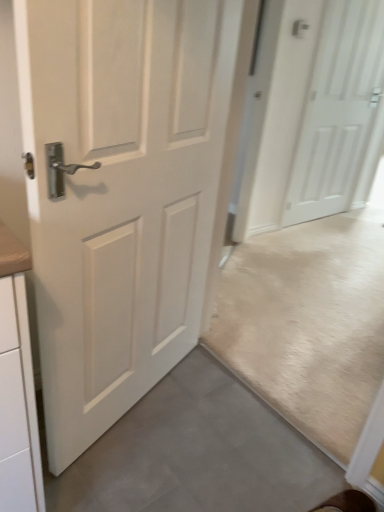
What do you see at coordinates (338, 110) in the screenshot? This screenshot has width=384, height=512. I see `white matte door at upper right, which ranks as the second door in front-to-back order` at bounding box center [338, 110].

This screenshot has height=512, width=384. I want to click on white matte door at upper right, the 2th door positioned from the left, so click(338, 110).

What is the approximate width of white matte door at upper right, which appears as the 1th door when viewed from the back?

white matte door at upper right, which appears as the 1th door when viewed from the back, is 2.31 inches in width.

What do you see at coordinates (121, 194) in the screenshot?
I see `white matte door at center, which appears as the 2th door when viewed from the back` at bounding box center [121, 194].

I want to click on white matte door at center, the 2th door viewed from the right, so click(121, 194).

Identify the location of white matte door at upper right, the first door from the right. (338, 110).

Which is more to the right, white matte door at center, the first door when ordered from front to back, or white matte door at upper right, which ranks as the second door in front-to-back order?

From the viewer's perspective, white matte door at upper right, which ranks as the second door in front-to-back order, appears more on the right side.

Considering the positions of objects white matte door at center, which appears as the 2th door when viewed from the back, and white matte door at upper right, the first door from the right, in the image provided, who is behind, white matte door at center, which appears as the 2th door when viewed from the back, or white matte door at upper right, the first door from the right,?

white matte door at upper right, the first door from the right.

Does point (110, 42) appear closer or farther from the camera than point (347, 49)?

Point (110, 42) is positioned closer to the camera compared to point (347, 49).

From the image's perspective, would you say white matte door at center, which is the 1th door from left to right, is shown under white matte door at upper right, which appears as the 1th door when viewed from the back?

Correct, white matte door at center, which is the 1th door from left to right, appears lower than white matte door at upper right, which appears as the 1th door when viewed from the back, in the image.

From a real-world perspective, is white matte door at center, which appears as the 2th door when viewed from the back, over white matte door at upper right, the first door from the right?

No, from a real-world perspective, white matte door at center, which appears as the 2th door when viewed from the back, is not over white matte door at upper right, the first door from the right

Between white matte door at center, which appears as the 2th door when viewed from the back, and white matte door at upper right, which ranks as the second door in front-to-back order, which one has smaller width?

white matte door at upper right, which ranks as the second door in front-to-back order, is thinner.

Considering the sizes of white matte door at center, the first door when ordered from front to back, and white matte door at upper right, which ranks as the second door in front-to-back order, in the image, is white matte door at center, the first door when ordered from front to back, taller or shorter than white matte door at upper right, which ranks as the second door in front-to-back order,?

Considering their sizes, white matte door at center, the first door when ordered from front to back, has less height than white matte door at upper right, which ranks as the second door in front-to-back order.

Based on the photo, who is bigger, white matte door at center, the 2th door viewed from the right, or white matte door at upper right, which ranks as the second door in front-to-back order?

Bigger between the two is white matte door at center, the 2th door viewed from the right.

Consider the image. Would you say white matte door at center, which appears as the 2th door when viewed from the back, is outside white matte door at upper right, which ranks as the second door in front-to-back order?

That's correct, white matte door at center, which appears as the 2th door when viewed from the back, is outside of white matte door at upper right, which ranks as the second door in front-to-back order.

Is white matte door at center, the 2th door viewed from the right, not near white matte door at upper right, the first door from the right?

white matte door at center, the 2th door viewed from the right, is positioned a significant distance from white matte door at upper right, the first door from the right.

Is white matte door at center, which appears as the 2th door when viewed from the back, turned away from white matte door at upper right, the first door from the right?

white matte door at center, which appears as the 2th door when viewed from the back, is not turned away from white matte door at upper right, the first door from the right.

This screenshot has height=512, width=384. In order to click on door above the white matte door at center, the first door when ordered from front to back (from a real-world perspective) in this screenshot , I will do `click(338, 110)`.

Which is more to the left, white matte door at upper right, the 2th door positioned from the left, or white matte door at center, which appears as the 2th door when viewed from the back?

From the viewer's perspective, white matte door at center, which appears as the 2th door when viewed from the back, appears more on the left side.

Is white matte door at upper right, which appears as the 1th door when viewed from the back, in front of or behind white matte door at center, the first door when ordered from front to back, in the image?

Visually, white matte door at upper right, which appears as the 1th door when viewed from the back, is located behind white matte door at center, the first door when ordered from front to back.

Based on the photo, which is nearer, (x=376, y=58) or (x=118, y=214)?

Clearly, point (x=376, y=58) is more distant from the camera than point (x=118, y=214).

In the scene shown: From the image's perspective, is white matte door at upper right, the 2th door positioned from the left, above white matte door at center, the first door when ordered from front to back?

Yes.

From a real-world perspective, is white matte door at upper right, which ranks as the second door in front-to-back order, below white matte door at center, which is the 1th door from left to right?

No, from a real-world perspective, white matte door at upper right, which ranks as the second door in front-to-back order, is not beneath white matte door at center, which is the 1th door from left to right.

Looking at their sizes, would you say white matte door at upper right, the 2th door positioned from the left, is wider or thinner than white matte door at center, the first door when ordered from front to back?

Answer: Considering their sizes, white matte door at upper right, the 2th door positioned from the left, looks slimmer than white matte door at center, the first door when ordered from front to back.

Considering the sizes of objects white matte door at upper right, which appears as the 1th door when viewed from the back, and white matte door at center, which appears as the 2th door when viewed from the back, in the image provided, who is shorter, white matte door at upper right, which appears as the 1th door when viewed from the back, or white matte door at center, which appears as the 2th door when viewed from the back,?

white matte door at center, which appears as the 2th door when viewed from the back, is shorter.

Can you confirm if white matte door at upper right, the first door from the right, is bigger than white matte door at center, the 2th door viewed from the right?

Actually, white matte door at upper right, the first door from the right, might be smaller than white matte door at center, the 2th door viewed from the right.

Is white matte door at upper right, the first door from the right, inside or outside of white matte door at center, the first door when ordered from front to back?

white matte door at upper right, the first door from the right, is not inside white matte door at center, the first door when ordered from front to back, it's outside.

Based on the photo, is white matte door at upper right, the 2th door positioned from the left, not near white matte door at center, which is the 1th door from left to right?

Absolutely, white matte door at upper right, the 2th door positioned from the left, is distant from white matte door at center, which is the 1th door from left to right.

Does white matte door at upper right, which ranks as the second door in front-to-back order, turn towards white matte door at center, which is the 1th door from left to right?

No.

Could you measure the distance between white matte door at upper right, the 2th door positioned from the left, and white matte door at center, the first door when ordered from front to back?

A distance of 6.66 feet exists between white matte door at upper right, the 2th door positioned from the left, and white matte door at center, the first door when ordered from front to back.

Image resolution: width=384 pixels, height=512 pixels. What are the coordinates of `door in front of the white matte door at upper right, the first door from the right` in the screenshot? It's located at (121, 194).

At what (x,y) coordinates should I click in order to perform the action: click on door below the white matte door at upper right, which appears as the 1th door when viewed from the back (from the image's perspective). Please return your answer as a coordinate pair (x, y). The image size is (384, 512). Looking at the image, I should click on (121, 194).

This screenshot has height=512, width=384. I want to click on door below the white matte door at upper right, the 2th door positioned from the left (from a real-world perspective), so coord(121,194).